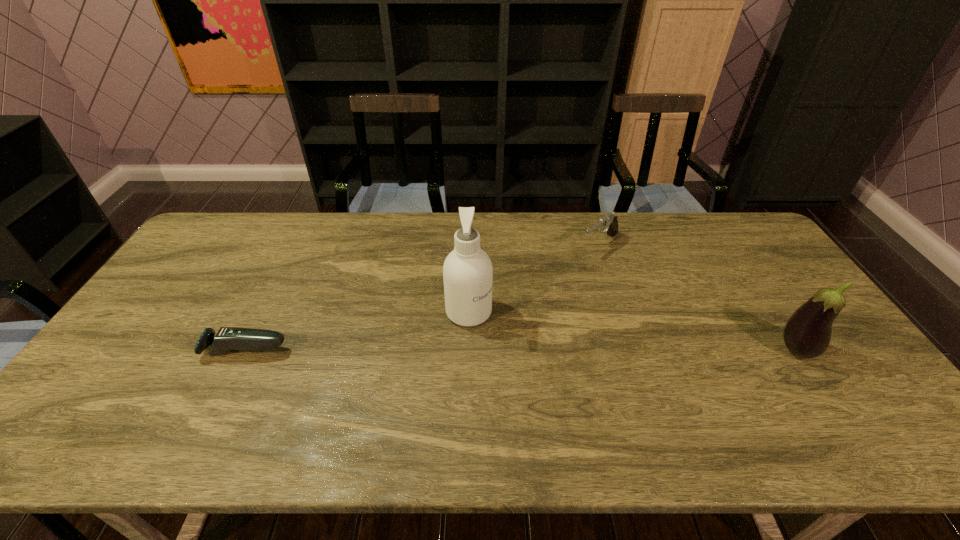
The image size is (960, 540). Identify the location of free space located 0.120m on the left of the rightmost object. pos(732,350).

Find the location of `vacant space located at the muzzle of the gun`. vacant space located at the muzzle of the gun is located at coordinates (545, 288).

The width and height of the screenshot is (960, 540). I want to click on blank area located at the muzzle of the gun, so click(x=561, y=275).

What are the coordinates of `vacant space located 0.060m at the muzzle of the gun` in the screenshot? It's located at click(577, 262).

At what (x,y) coordinates should I click in order to perform the action: click on vacant space located on the front label of the tallest object. Please return your answer as a coordinate pair (x, y). Looking at the image, I should click on (516, 340).

Find the location of a particular element. The height and width of the screenshot is (540, 960). vacant space situated 0.200m on the front label of the tallest object is located at coordinates (546, 359).

This screenshot has width=960, height=540. I want to click on vacant area situated 0.320m on the front label of the tallest object, so click(x=588, y=383).

Identify the location of object that is positioned at the far edge. This screenshot has width=960, height=540. (609, 221).

Locate an element on the screen. The height and width of the screenshot is (540, 960). object situated at the right edge is located at coordinates (807, 333).

Where is `free region at the far edge of the desktop`? free region at the far edge of the desktop is located at coordinates (373, 241).